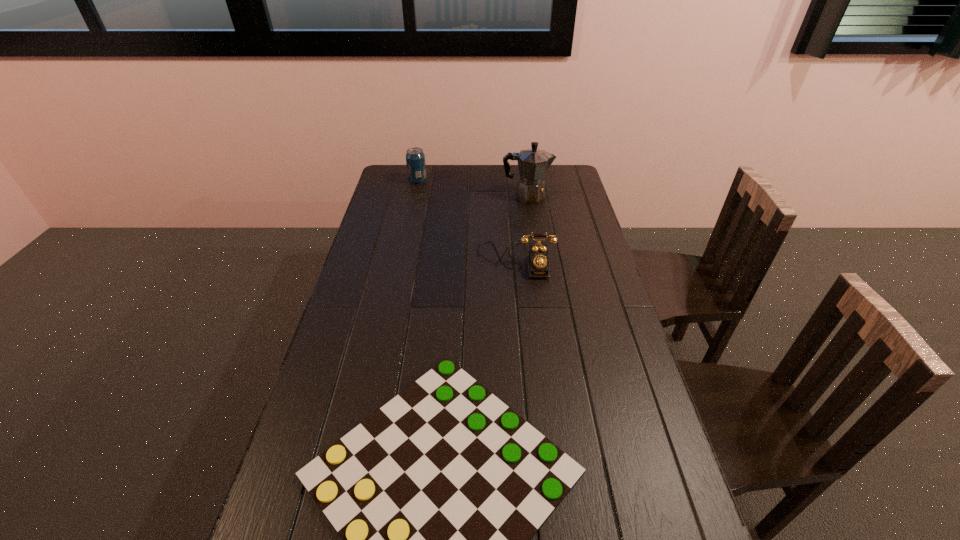
Where is `the second farthest object`? the second farthest object is located at coordinates (533, 163).

Where is `the tallest object`? This screenshot has width=960, height=540. the tallest object is located at coordinates (533, 163).

What are the coordinates of `the farthest object` in the screenshot? It's located at (415, 158).

The image size is (960, 540). Identify the location of telephone. (538, 259).

I want to click on the second shortest object, so click(538, 259).

Identify the location of vacant space positioned on the pouring side of the third nearest object. The height and width of the screenshot is (540, 960). (566, 197).

At what (x,y) coordinates should I click in order to perform the action: click on vacant region located 0.050m on the back of the pop soda. Please return your answer as a coordinate pair (x, y). Looking at the image, I should click on (420, 171).

Locate an element on the screen. vacant position located 0.200m on the dial of the third farthest object is located at coordinates (522, 323).

At what (x,y) coordinates should I click in order to perform the action: click on coffeepot at the far edge. Please return your answer as a coordinate pair (x, y). This screenshot has height=540, width=960. Looking at the image, I should click on (533, 163).

Locate an element on the screen. Image resolution: width=960 pixels, height=540 pixels. pop soda that is positioned at the far edge is located at coordinates (415, 158).